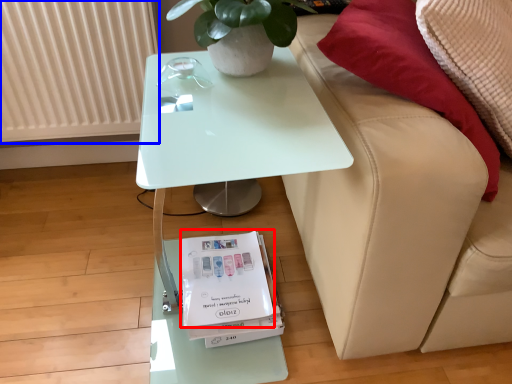
Question: Which object is closer to the camera taking this photo, magazine (highlighted by a red box) or radiator (highlighted by a blue box)?

Choices:
 (A) magazine
 (B) radiator

Answer: (A)